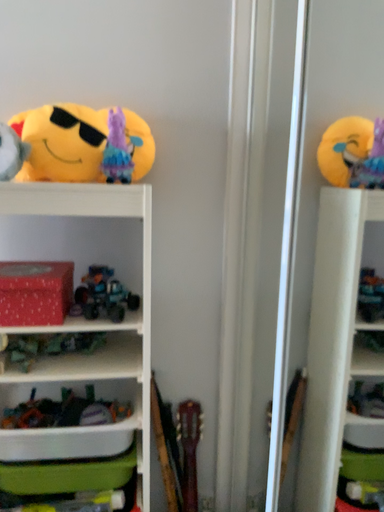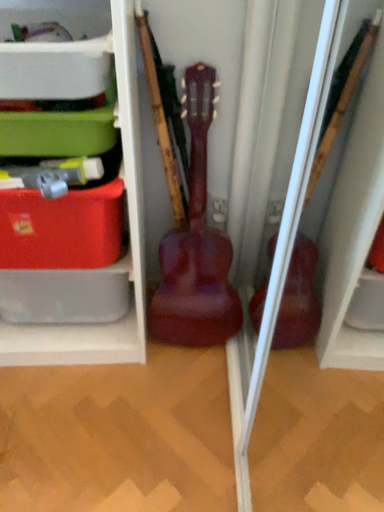
Question: How did the camera likely rotate when shooting the video?

Choices:
 (A) rotated downward
 (B) rotated upward

Answer: (A)